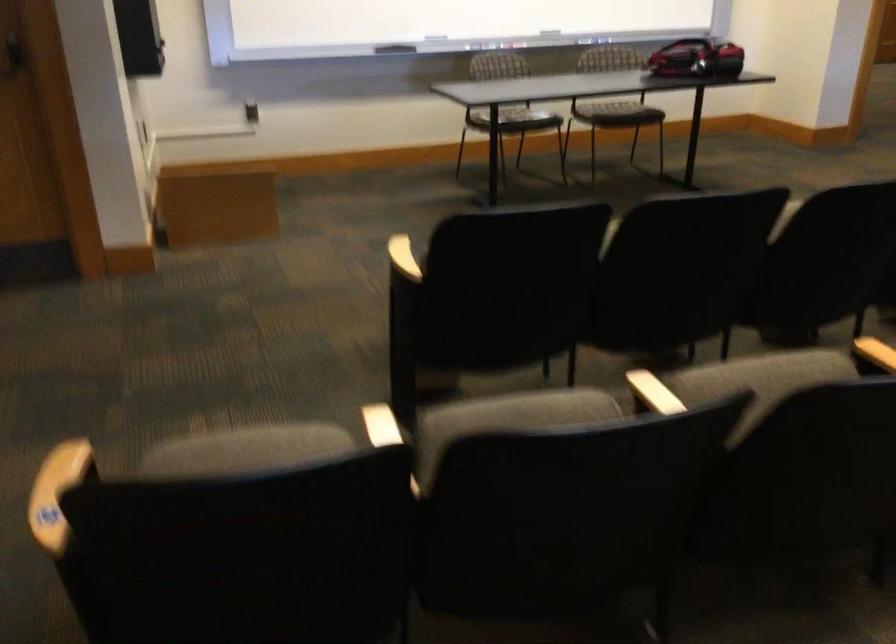
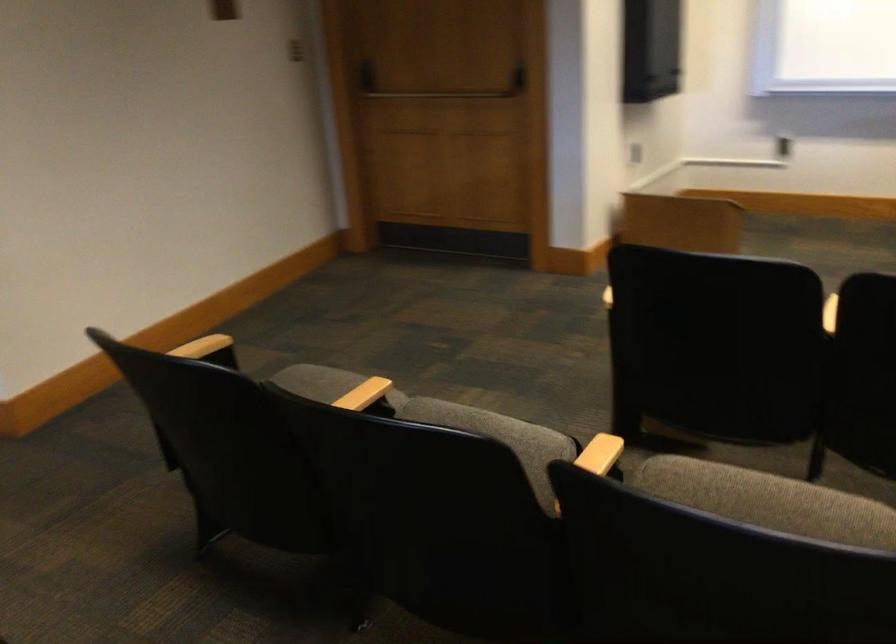
In the second image, find the point that corresponds to the point at 770,365 in the first image.

(789, 504)